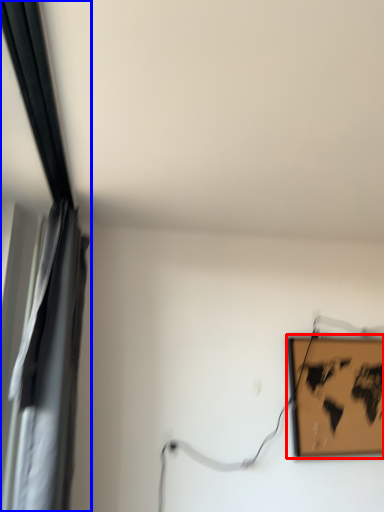
Question: Which object appears farthest to the camera in this image, picture frame (highlighted by a red box) or curtain (highlighted by a blue box)?

Choices:
 (A) picture frame
 (B) curtain

Answer: (A)